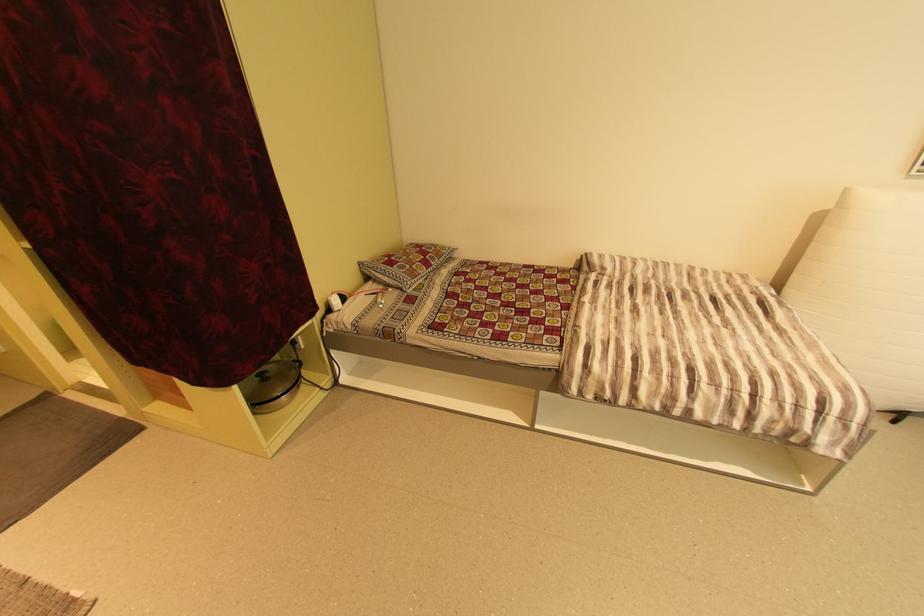
Where would you lift the pot lid handle? Please return your answer as a coordinate pair (x, y).

(261, 371)